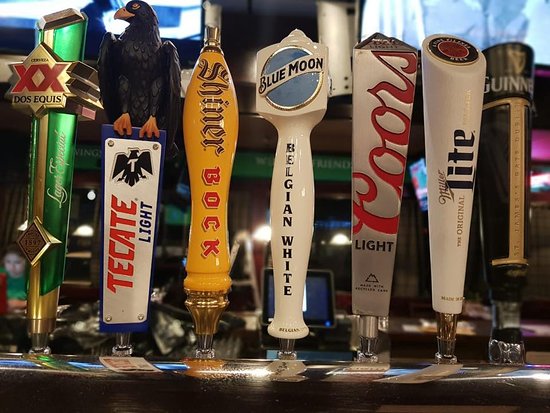
What are the coordinates of `beer tap handles` in the screenshot? It's located at (60, 95), (125, 145), (209, 118), (306, 84), (392, 126), (454, 135), (509, 130).